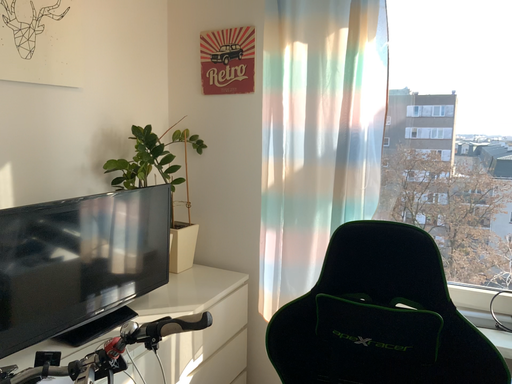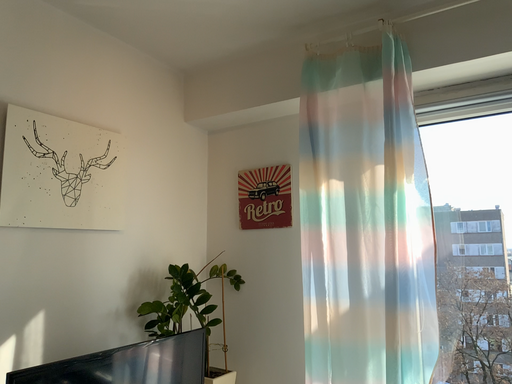
Question: Which way did the camera rotate in the video?

Choices:
 (A) rotated downward
 (B) rotated upward

Answer: (B)